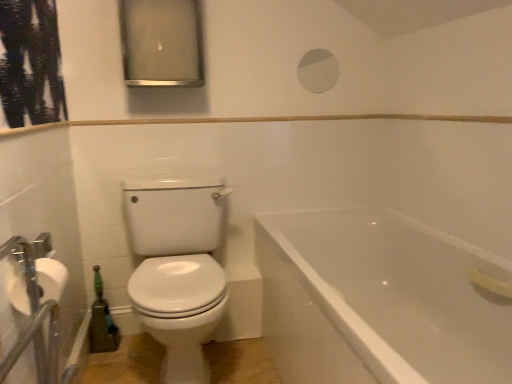
Question: Is white glossy toilet at left situated inside white matte toilet paper at left or outside?

Choices:
 (A) inside
 (B) outside

Answer: (B)

Question: Considering the positions of white glossy toilet at left and white matte toilet paper at left in the image, is white glossy toilet at left taller or shorter than white matte toilet paper at left?

Choices:
 (A) short
 (B) tall

Answer: (B)

Question: Estimate the real-world distances between objects in this image. Which object is closer to the white glossy mirror at upper center?

Choices:
 (A) matte silver medicine cabinet at upper center
 (B) white glossy bathtub at lower right
 (C) white matte toilet paper at left
 (D) white glossy toilet at left

Answer: (A)

Question: Considering the real-world distances, which object is farthest from the white matte toilet paper at left?

Choices:
 (A) white glossy mirror at upper center
 (B) matte silver medicine cabinet at upper center
 (C) white glossy bathtub at lower right
 (D) white glossy toilet at left

Answer: (A)